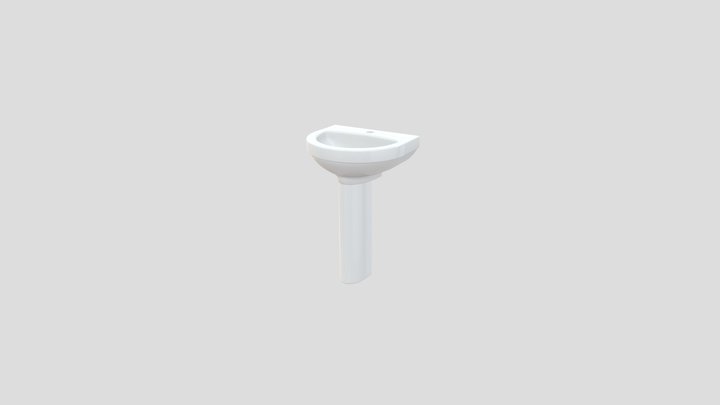
Where is `top of sink`? This screenshot has height=405, width=720. top of sink is located at coordinates (358, 132).